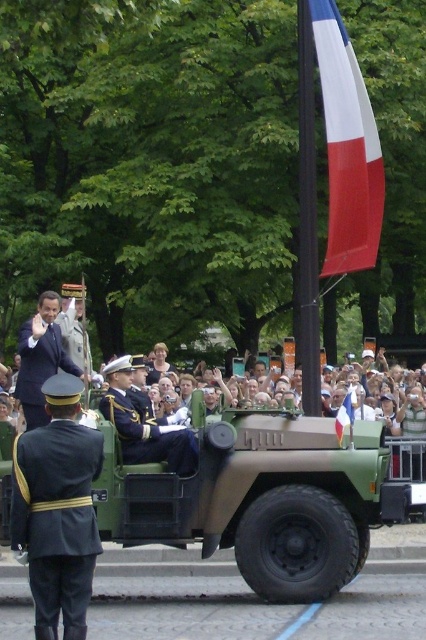
You are a photographer at the event and need to capture both the dark blue suit at center and the shiny blue fabric uniform at center in a single photo. Can you fit both in the frame if your camera has a minimum focus distance of 28 inches?

The dark blue suit at center and the shiny blue fabric uniform at center are 28.02 inches apart. Since the minimum focus distance is 28 inches, the photographer can just barely fit both in the frame as the distance between them is slightly over the minimum requirement.

You are a photographer at the event. You want to take a photo that includes both the tricolor fabric flag at upper right and the shiny blue fabric uniform at center. Which object should be placed closer to the camera to ensure both are visible in the frame?

The tricolor fabric flag at upper right is positioned over the shiny blue fabric uniform at center. To ensure both are visible in the frame, the shiny blue fabric uniform at center should be placed closer to the camera so that the flag above it doesn

You are a photographer standing at the center of the scene. You want to take a photo that includes both the tricolor fabric flag at upper right and the dark blue suit at center. Given that your camera has a maximum horizontal field of view of 6 meters, can you capture both subjects in a single frame without moving?

The tricolor fabric flag at upper right and dark blue suit at center are 7.43 meters apart, which exceeds the camera field of view of 6 meters. Therefore, you cannot capture both in a single frame without moving.